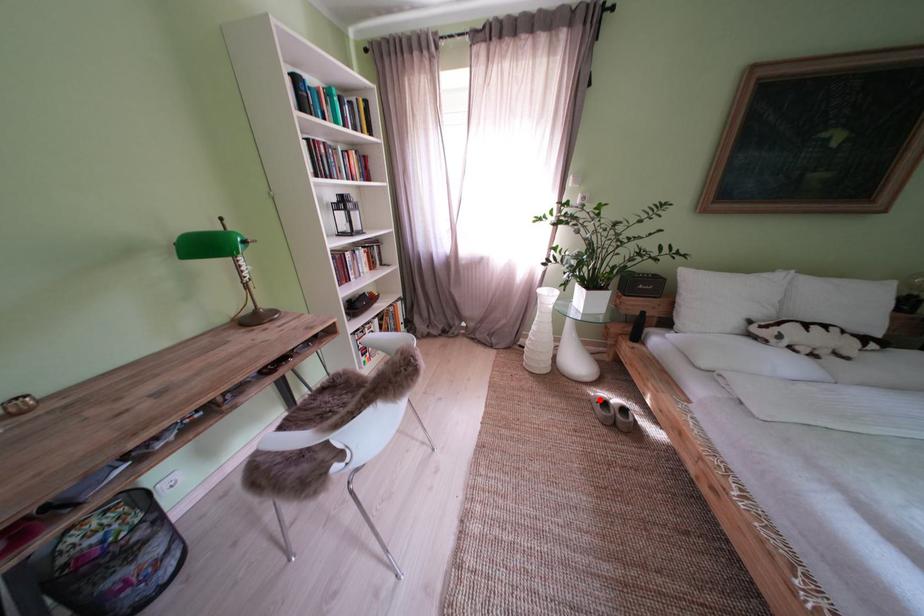
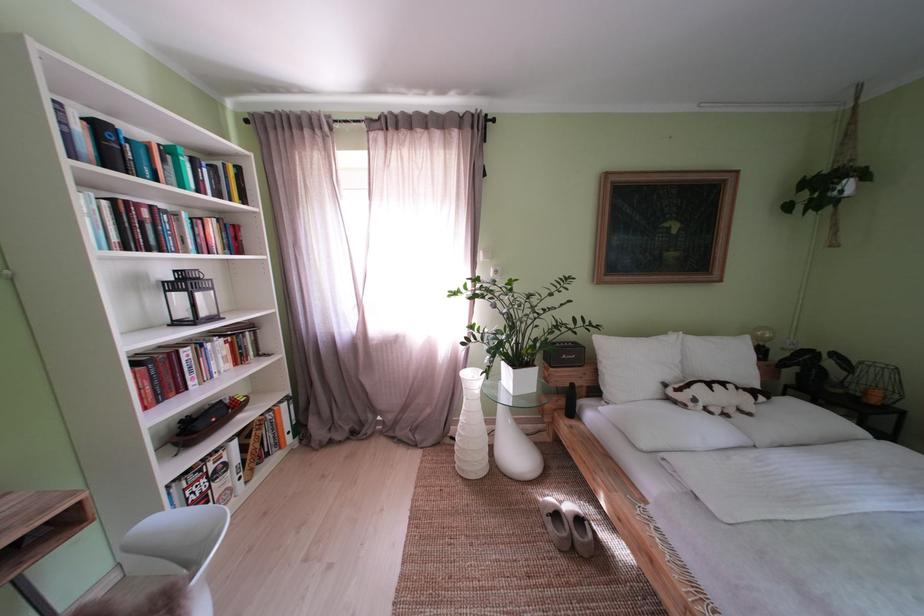
Question: A red point is marked in image1. In image2, is the corresponding 3D point closer to the camera or farther? Reply with the corresponding letter.

Choices:
 (A) The corresponding 3D point is closer.
 (B) The corresponding 3D point is farther.

Answer: (B)